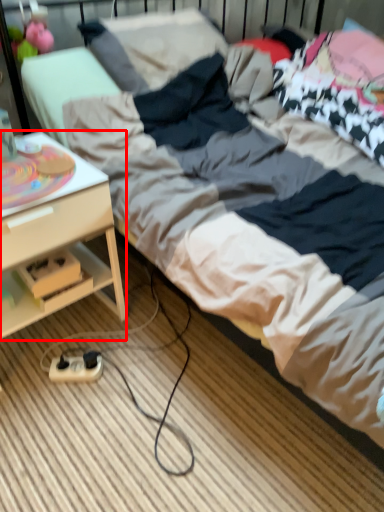
Question: In this image, where is desk (annotated by the red box) located relative to extension cord?

Choices:
 (A) left
 (B) right

Answer: (A)